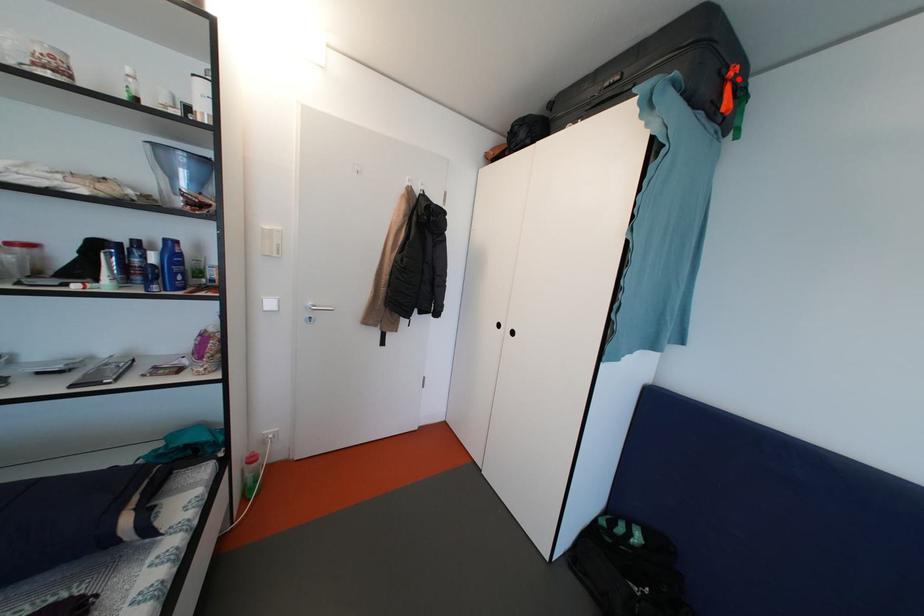
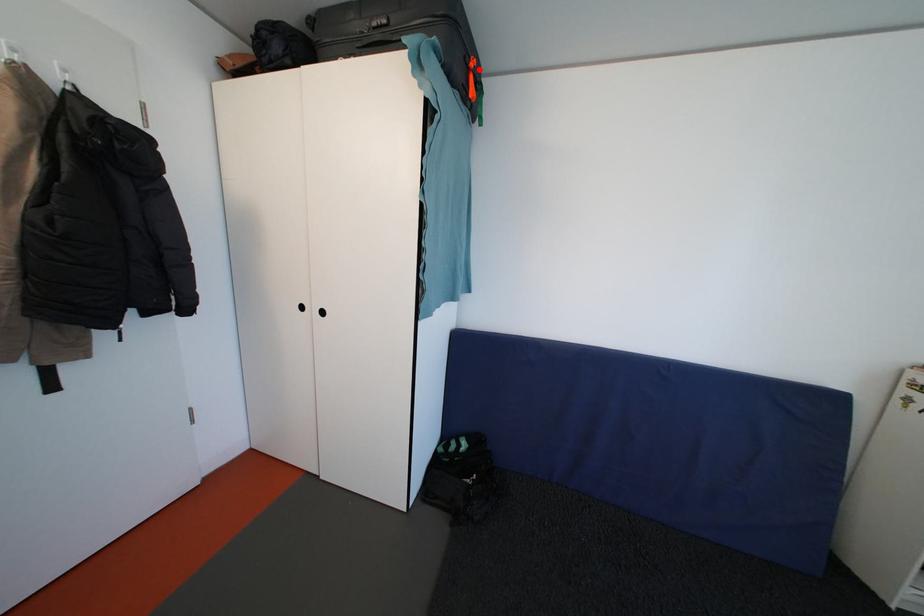
I am providing you with two images of the same scene from different viewpoints. A red point is marked on the first image and another point is marked on the second image. Do the highlighted points in image1 and image2 indicate the same real-world spot?

Yes